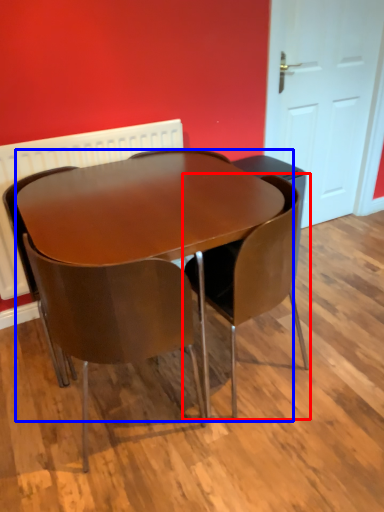
Question: Which of the following is the farthest to the observer, chair (highlighted by a red box) or table (highlighted by a blue box)?

Choices:
 (A) chair
 (B) table

Answer: (A)